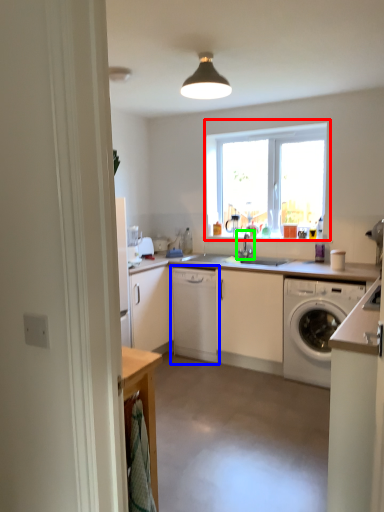
Question: Which is farther away from window (highlighted by a red box)? cabinetry (highlighted by a blue box) or tap (highlighted by a green box)?

Choices:
 (A) cabinetry
 (B) tap

Answer: (A)